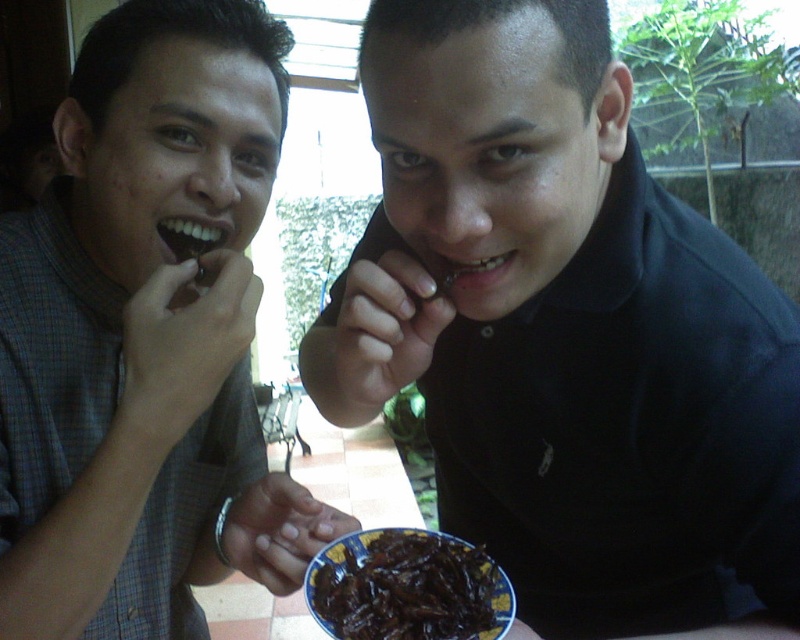
You are a photographer trying to capture a closeup of the dark glossy insects at center. You need to ensure the black matte shirt at center doesn not block the view. Based on the scene, where should you position yourself relative to the insects?

The black matte shirt at center is positioned on the right side of dark glossy insects at center. To avoid blocking the view, you should position yourself to the left side of the insects.

You are a photographer trying to capture a candid shot of both individuals in the scene. You notice that the black matte shirt at center and the matte black shirt at left are positioned in a way that might block each other. Based on their positions, which one is higher up and would be less likely to be obscured by the other?

The black matte shirt at center is above the matte black shirt at left, so it would be less likely to be obscured since it is positioned higher.